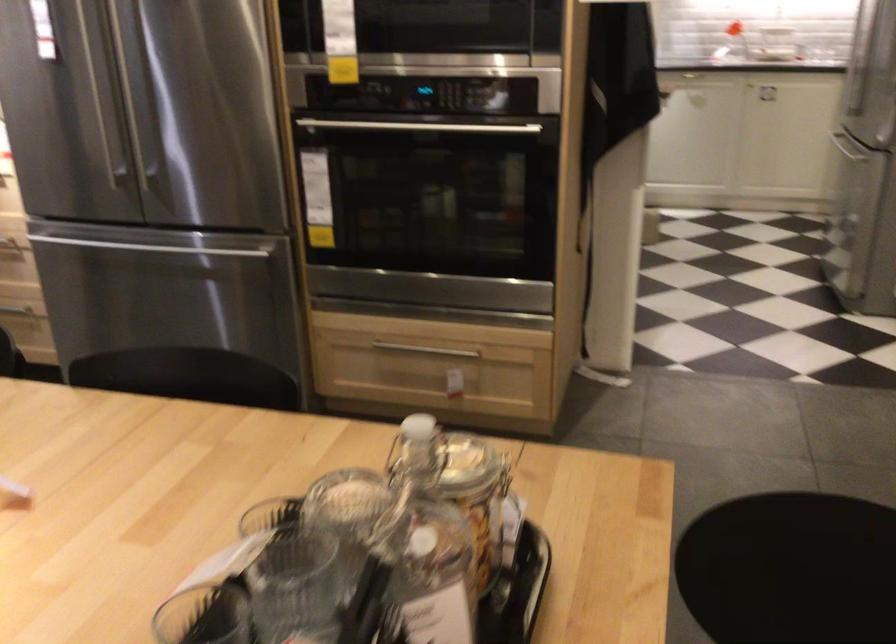
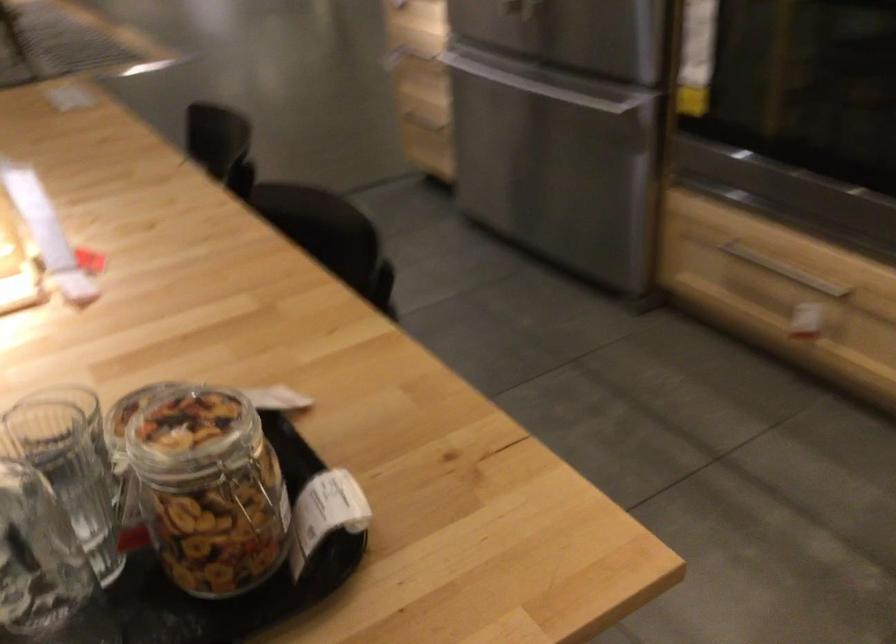
Locate, in the second image, the point that corresponds to [492,497] in the first image.

(209, 489)